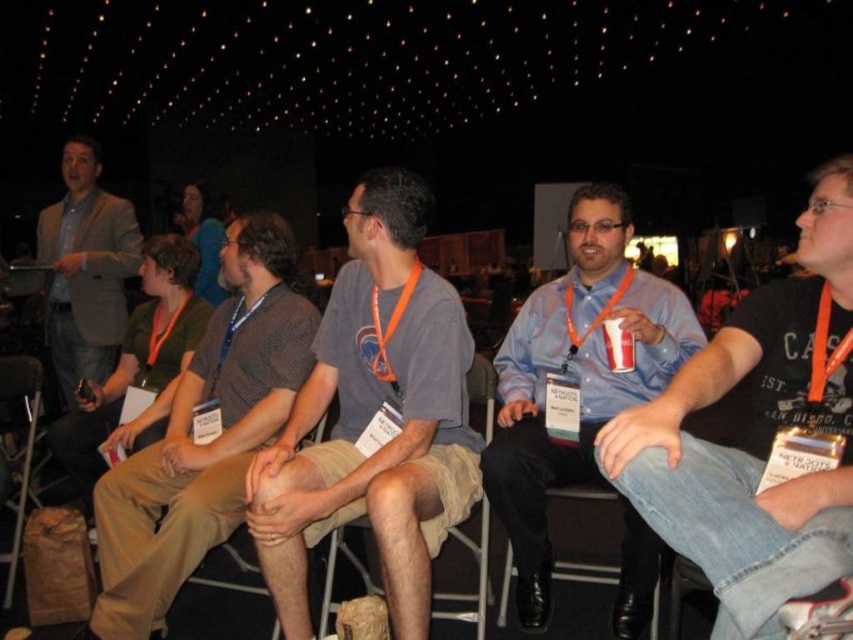
Does denim jeans at center have a greater height compared to tan fabric chair at center?

Correct, denim jeans at center is much taller as tan fabric chair at center.

Looking at this image, is denim jeans at center below tan fabric chair at center?

No.

Which is in front, point (830, 376) or point (436, 593)?

Positioned in front is point (830, 376).

Image resolution: width=853 pixels, height=640 pixels. In order to click on denim jeans at center in this screenshot , I will do `click(757, 433)`.

Does blue shirt at center have a lesser height compared to green cotton shirt at left?

No, blue shirt at center is not shorter than green cotton shirt at left.

Can you confirm if blue shirt at center is wider than green cotton shirt at left?

Correct, the width of blue shirt at center exceeds that of green cotton shirt at left.

This screenshot has width=853, height=640. What are the coordinates of `blue shirt at center` in the screenshot? It's located at (575, 376).

At what (x,y) coordinates should I click in order to perform the action: click on blue shirt at center. Please return your answer as a coordinate pair (x, y). The image size is (853, 640). Looking at the image, I should click on (575, 376).

Can you confirm if green cotton shirt at left is positioned above dark brown hair at center?

Actually, green cotton shirt at left is below dark brown hair at center.

Is green cotton shirt at left in front of dark brown hair at center?

Yes, green cotton shirt at left is in front of dark brown hair at center.

Describe the element at coordinates (136, 368) in the screenshot. I see `green cotton shirt at left` at that location.

In order to click on green cotton shirt at left in this screenshot , I will do `click(136, 368)`.